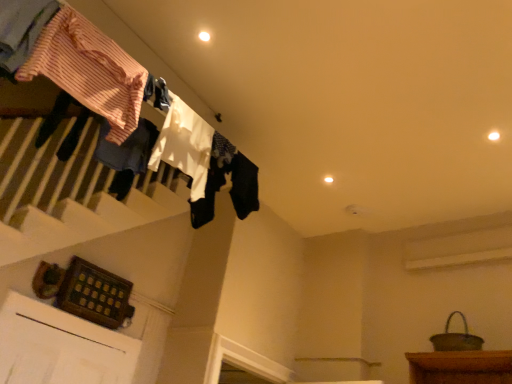
Question: Considering the relative sizes of white fabric at upper center, the 3th clothing in the front-to-back sequence, and striped cotton shirt at upper left, arranged as the 2th clothing when viewed from the front, in the image provided, is white fabric at upper center, the 3th clothing in the front-to-back sequence, taller than striped cotton shirt at upper left, arranged as the 2th clothing when viewed from the front,?

Choices:
 (A) yes
 (B) no

Answer: (A)

Question: Is striped cotton shirt at upper left, the third clothing in the back-to-front sequence, surrounded by white fabric at upper center, the 3th clothing in the front-to-back sequence?

Choices:
 (A) yes
 (B) no

Answer: (B)

Question: Does white fabric at upper center, the 3th clothing in the front-to-back sequence, have a greater width compared to striped cotton shirt at upper left, arranged as the 2th clothing when viewed from the front?

Choices:
 (A) yes
 (B) no

Answer: (B)

Question: Is white fabric at upper center, the 3th clothing in the front-to-back sequence, at the left side of striped cotton shirt at upper left, the third clothing in the back-to-front sequence?

Choices:
 (A) yes
 (B) no

Answer: (B)

Question: Is white fabric at upper center, the 3th clothing in the front-to-back sequence, shorter than striped cotton shirt at upper left, the third clothing in the back-to-front sequence?

Choices:
 (A) no
 (B) yes

Answer: (A)

Question: Does white fabric at upper center, the 3th clothing in the front-to-back sequence, turn towards striped cotton shirt at upper left, the third clothing in the back-to-front sequence?

Choices:
 (A) yes
 (B) no

Answer: (B)

Question: Does white cotton socks at upper center, arranged as the fourth clothing when viewed from the front, come behind striped cotton shirt at upper left, positioned as the 1th clothing in front-to-back order?

Choices:
 (A) yes
 (B) no

Answer: (A)

Question: Is white cotton socks at upper center, which is the 1th clothing in back-to-front order, shorter than striped cotton shirt at upper left, positioned as the 1th clothing in front-to-back order?

Choices:
 (A) no
 (B) yes

Answer: (B)

Question: Could you tell me if white cotton socks at upper center, arranged as the fourth clothing when viewed from the front, is facing striped cotton shirt at upper left, marked as the 4th clothing in a back-to-front arrangement?

Choices:
 (A) yes
 (B) no

Answer: (B)

Question: Is white cotton socks at upper center, arranged as the fourth clothing when viewed from the front, turned away from striped cotton shirt at upper left, marked as the 4th clothing in a back-to-front arrangement?

Choices:
 (A) yes
 (B) no

Answer: (B)

Question: From a real-world perspective, is white cotton socks at upper center, which is the 1th clothing in back-to-front order, physically above striped cotton shirt at upper left, positioned as the 1th clothing in front-to-back order?

Choices:
 (A) yes
 (B) no

Answer: (A)

Question: Is white cotton socks at upper center, which is the 1th clothing in back-to-front order, surrounding striped cotton shirt at upper left, marked as the 4th clothing in a back-to-front arrangement?

Choices:
 (A) yes
 (B) no

Answer: (B)

Question: Is striped cotton shirt at upper left, the third clothing in the back-to-front sequence, positioned beyond the bounds of white cotton socks at upper center, arranged as the fourth clothing when viewed from the front?

Choices:
 (A) yes
 (B) no

Answer: (A)